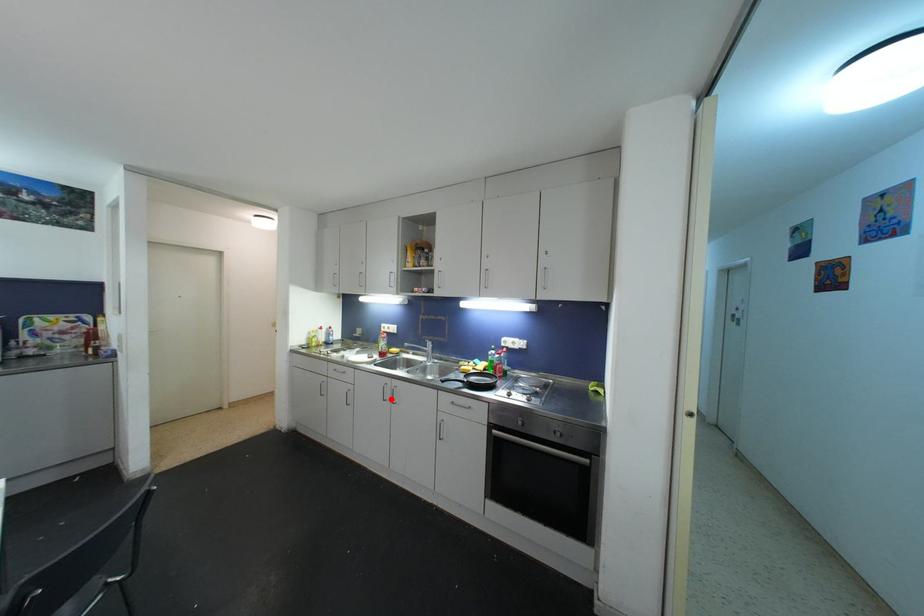
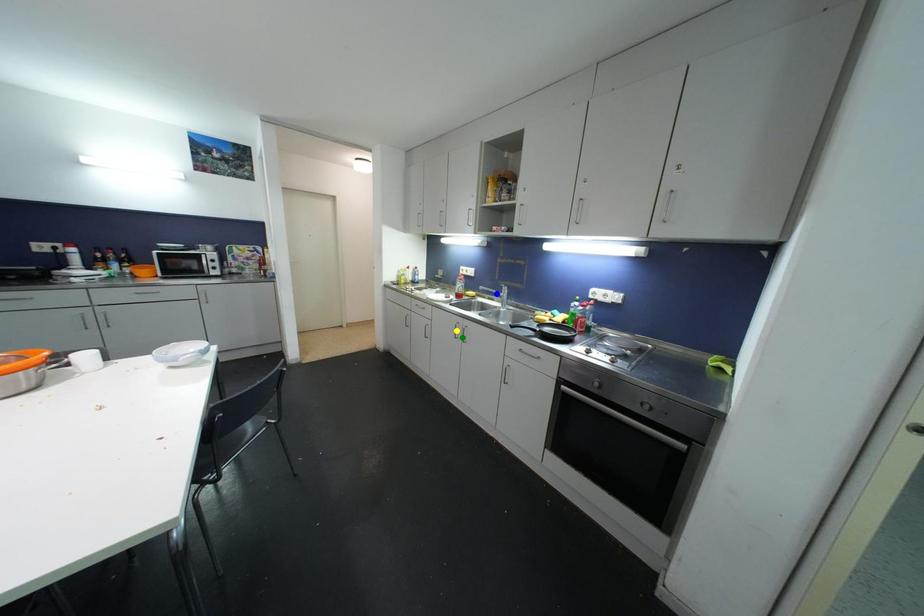
Question: I am providing you with two images of the same scene from different viewpoints. A red point is marked on the first image. You are given multiple points on the second image. Can you choose the point in image 2 that corresponds to the point in image 1?

Choices:
 (A) green point
 (B) yellow point
 (C) blue point

Answer: (A)